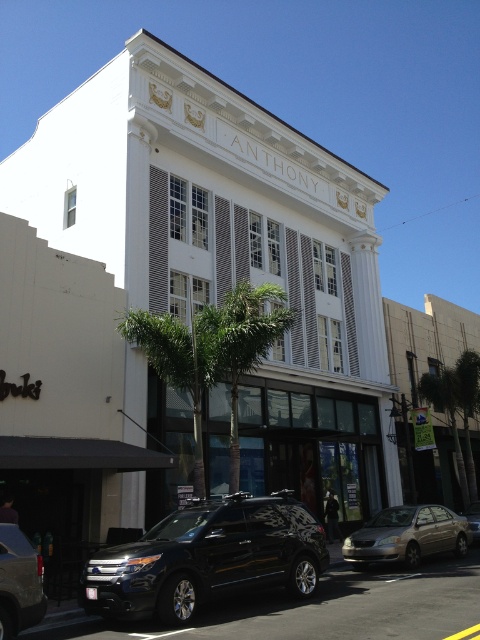
Can you confirm if metallic silver suv at lower left is positioned below metallic silver suv at center?

No.

Locate an element on the screen. This screenshot has width=480, height=640. metallic silver suv at lower left is located at coordinates (19, 582).

What do you see at coordinates (19, 582) in the screenshot? This screenshot has width=480, height=640. I see `metallic silver suv at lower left` at bounding box center [19, 582].

Locate an element on the screen. metallic silver suv at lower left is located at coordinates (19, 582).

Measure the distance between silver metallic sedan at lower center and camera.

silver metallic sedan at lower center is 15.88 meters from camera.

Locate an element on the screen. Image resolution: width=480 pixels, height=640 pixels. silver metallic sedan at lower center is located at coordinates (408, 536).

Locate an element on the screen. This screenshot has width=480, height=640. silver metallic sedan at lower center is located at coordinates (408, 536).

Who is shorter, glossy black suv at lower left or metallic silver suv at lower left?

With less height is glossy black suv at lower left.

Measure the distance between glossy black suv at lower left and metallic silver suv at lower left.

glossy black suv at lower left is 3.07 meters away from metallic silver suv at lower left.

Does point (267, 586) come in front of point (29, 595)?

That is False.

Identify the location of glossy black suv at lower left. Image resolution: width=480 pixels, height=640 pixels. (207, 557).